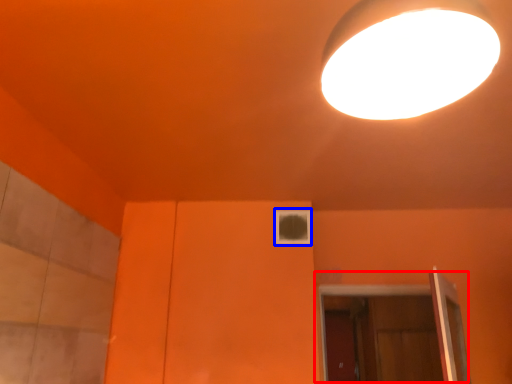
Question: Which object appears farthest to the camera in this image, door (highlighted by a red box) or window (highlighted by a blue box)?

Choices:
 (A) door
 (B) window

Answer: (A)